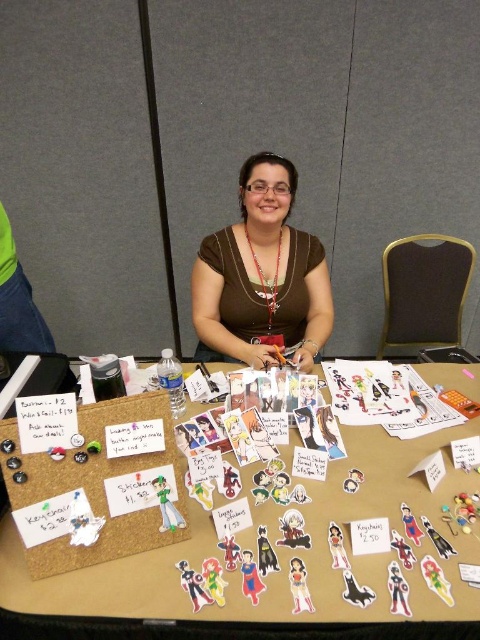
Question: Which point appears farthest from the camera in this image?

Choices:
 (A) (240, 592)
 (B) (215, 259)
 (C) (255, 264)

Answer: (B)

Question: Based on their relative distances, which object is farther from the silver metallic necklace at center?

Choices:
 (A) brown matte shirt at center
 (B) corkboard at center

Answer: (B)

Question: Observing the image, what is the correct spatial positioning of corkboard at center in reference to brown matte shirt at center?

Choices:
 (A) below
 (B) above

Answer: (A)

Question: Is brown matte shirt at center smaller than silver metallic necklace at center?

Choices:
 (A) yes
 (B) no

Answer: (B)

Question: Which object is positioned farthest from the corkboard at center?

Choices:
 (A) silver metallic necklace at center
 (B) brown matte shirt at center

Answer: (A)

Question: Does corkboard at center have a greater width compared to silver metallic necklace at center?

Choices:
 (A) no
 (B) yes

Answer: (B)